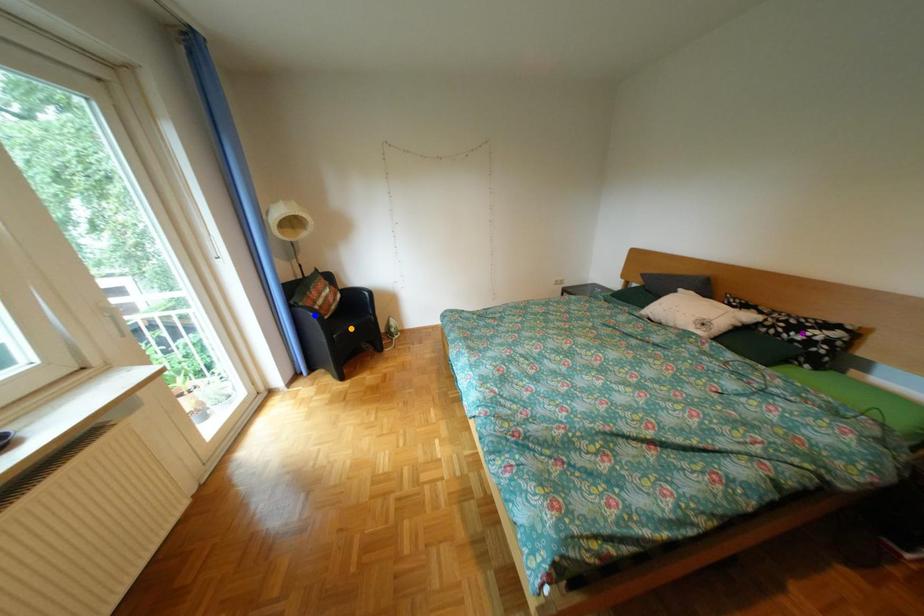
Order these from farthest to nearest:
purple point | blue point | orange point

orange point → blue point → purple point